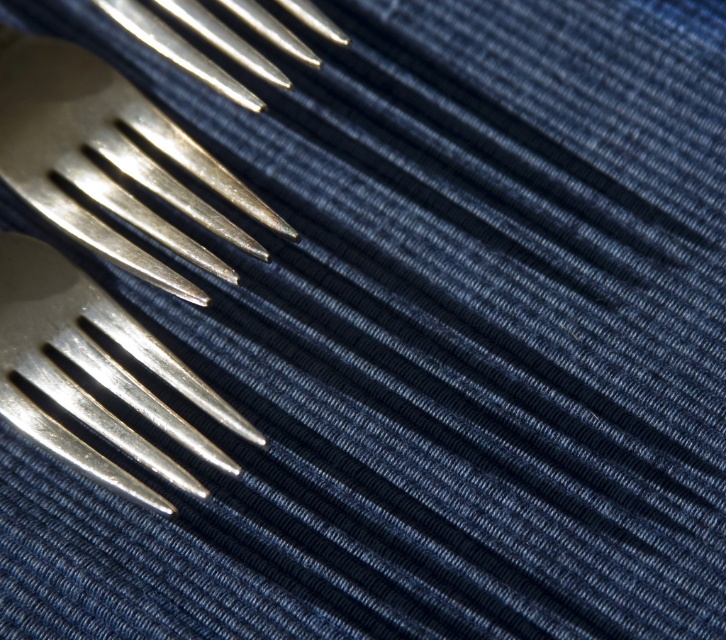
You are taking a photo of two points labeled as point (61, 192) and point (41, 352). Which point is closer to the camera?

Point (61, 192) is further to the camera than point (41, 352), so point (41, 352) is closer to the camera.

You are standing in a kitchen and see the polished silver fork at upper left. If you want to pick it up without moving your feet, can you reach it?

The polished silver fork at upper left is 4.54 feet from the viewer, which is approximately 54.5 inches. Since the average human arm length is about 25 to 30 inches, you cannot reach it without moving your feet.

You are arranging a dinner setting and need to place a decorative plate at the center of the image. The polished silver fork at upper left is currently in the way. Which direction should you move the fork to clear space for the plate?

The polished silver fork at upper left is located at point (110, 160). To clear space for the decorative plate at the center, move the fork downward and to the right.